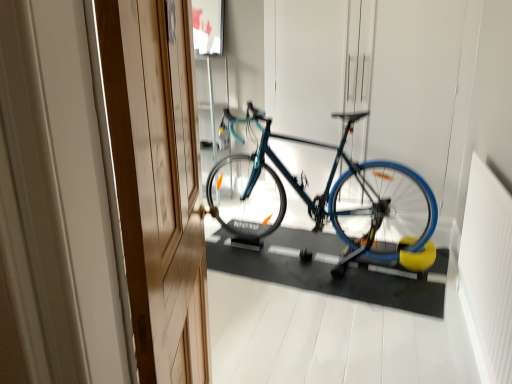
Question: Should I look upward or downward to see wooden door at left?

Choices:
 (A) down
 (B) up

Answer: (A)

Question: Is shiny blue bicycle at center at the right side of wooden door at left?

Choices:
 (A) no
 (B) yes

Answer: (B)

Question: Is the depth of shiny blue bicycle at center greater than that of wooden door at left?

Choices:
 (A) yes
 (B) no

Answer: (A)

Question: Is shiny blue bicycle at center positioned far away from wooden door at left?

Choices:
 (A) no
 (B) yes

Answer: (B)

Question: From the image's perspective, is shiny blue bicycle at center on wooden door at left?

Choices:
 (A) yes
 (B) no

Answer: (A)

Question: Is shiny blue bicycle at center completely or partially outside of wooden door at left?

Choices:
 (A) yes
 (B) no

Answer: (A)

Question: Is shiny blue bicycle at center turned away from wooden door at left?

Choices:
 (A) yes
 (B) no

Answer: (B)

Question: Is wooden door at left surrounding shiny blue bicycle at center?

Choices:
 (A) no
 (B) yes

Answer: (A)

Question: Is wooden door at left aimed at shiny blue bicycle at center?

Choices:
 (A) no
 (B) yes

Answer: (B)

Question: Are wooden door at left and shiny blue bicycle at center beside each other?

Choices:
 (A) no
 (B) yes

Answer: (A)

Question: Does wooden door at left appear on the right side of shiny blue bicycle at center?

Choices:
 (A) yes
 (B) no

Answer: (B)

Question: From a real-world perspective, is wooden door at left over shiny blue bicycle at center?

Choices:
 (A) no
 (B) yes

Answer: (B)

Question: From the image's perspective, is wooden door at left above shiny blue bicycle at center?

Choices:
 (A) yes
 (B) no

Answer: (B)

Question: Would you say wooden door at left is inside or outside shiny blue bicycle at center?

Choices:
 (A) inside
 (B) outside

Answer: (B)